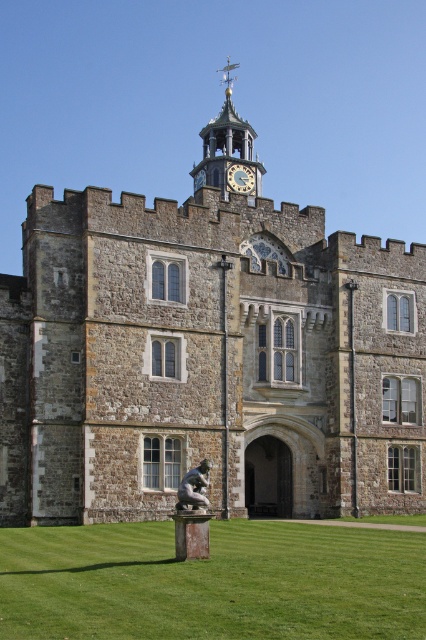
Question: Which point is closer to the camera?

Choices:
 (A) green grass at lower center
 (B) bronze statue at center
 (C) brown stone castle at center

Answer: (A)

Question: Which of these objects is positioned closest to the stone clock tower at upper center?

Choices:
 (A) brown stone castle at center
 (B) green grass at lower center
 (C) gold metallic clock at upper center
 (D) bronze statue at center

Answer: (C)

Question: Is brown stone castle at center closer to camera compared to stone clock tower at upper center?

Choices:
 (A) no
 (B) yes

Answer: (B)

Question: Is stone clock tower at upper center to the left of bronze statue at center from the viewer's perspective?

Choices:
 (A) yes
 (B) no

Answer: (B)

Question: Can you confirm if brown stone castle at center is positioned above bronze statue at center?

Choices:
 (A) no
 (B) yes

Answer: (B)

Question: Which is farther from the bronze statue at center?

Choices:
 (A) green grass at lower center
 (B) brown stone castle at center
 (C) gold metallic clock at upper center

Answer: (C)